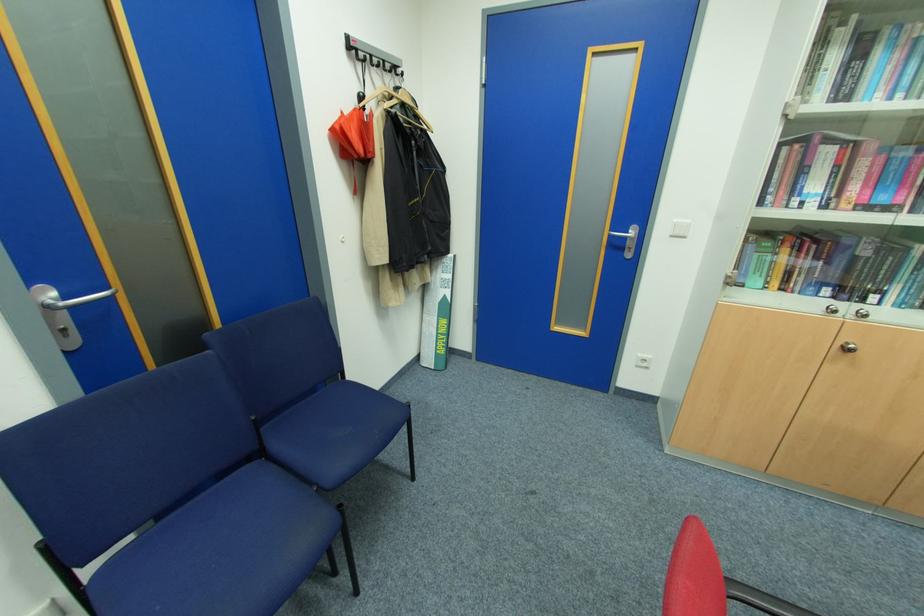
The location [354,134] corresponds to which object?

It corresponds to the red umbrella in the image.